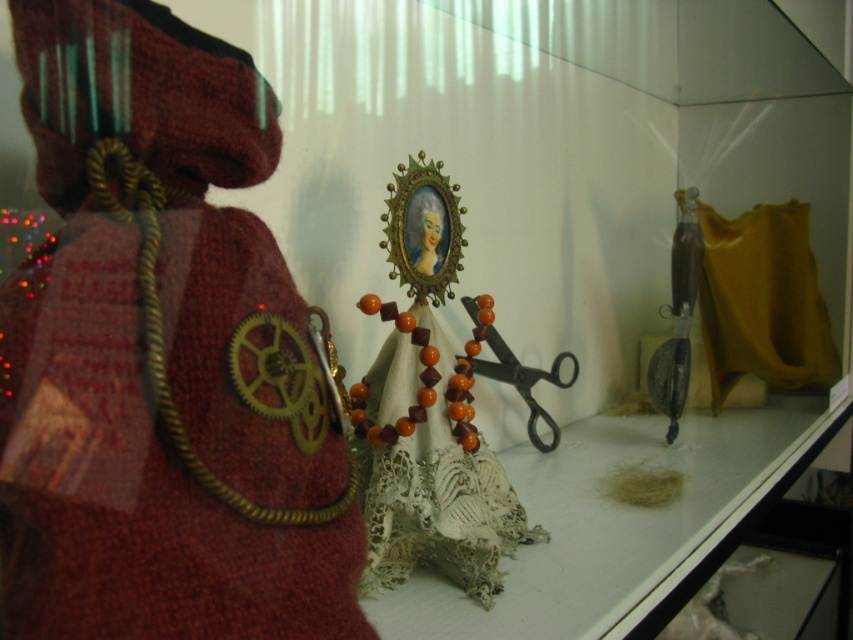
You are an artist trying to decide which object to photograph first. The orange beaded necklace at center and the black metal scissors at center are both in your view. Which object is smaller and should you focus your camera on first if you want to capture details of the smaller item?

The orange beaded necklace at center is smaller than the black metal scissors at center, so you should focus your camera on the orange beaded necklace at center first to capture its details.

You are standing in front of a display case with two points marked as point 1 at coordinates (x=456, y=221) and point 2 at (x=556, y=355). Which point is closer to you?

Point 1 at coordinates (x=456, y=221) is closer to you because it is in front of point 2 at (x=556, y=355).